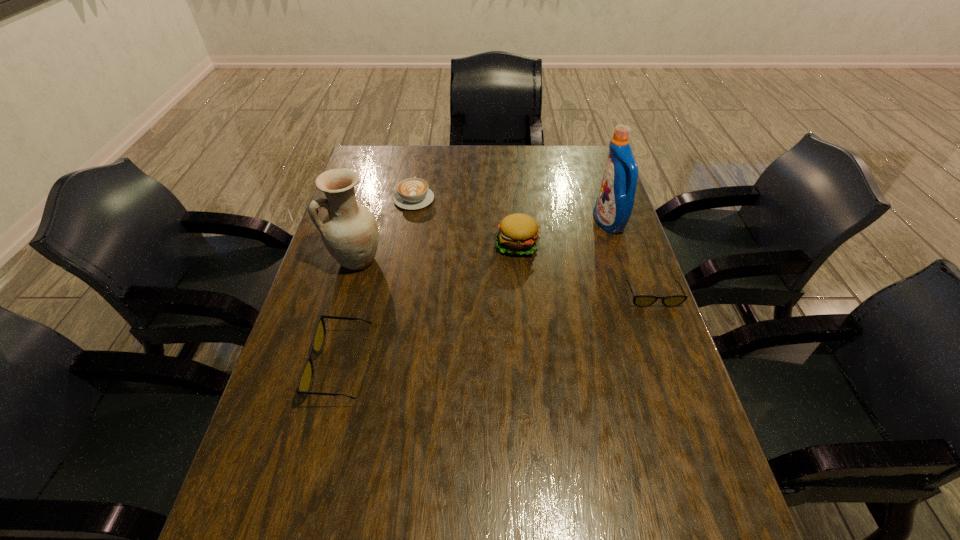
I want to click on vacant point that satisfies the following two spatial constraints: 1. on the label of the detergent; 2. on the front side of the hamburger, so click(x=616, y=244).

This screenshot has width=960, height=540. Identify the location of vacant position in the image that satisfies the following two spatial constraints: 1. on the label of the detergent; 2. on the front side of the hamburger. (616, 244).

This screenshot has width=960, height=540. I want to click on free spot that satisfies the following two spatial constraints: 1. on the front side of the third object from right to left; 2. on the front-facing side of the taller sunglasses, so click(528, 366).